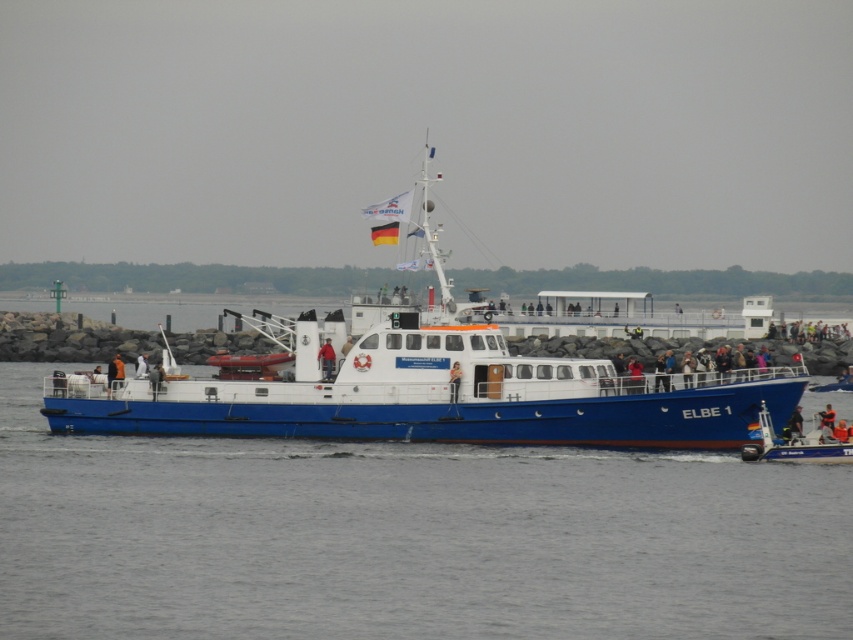
You are on the deck of the ferry ELBE 1 and need to locate a specific orange fabric jacket at center. According to the coordinates provided, where exactly would you find this jacket?

The orange fabric jacket at center is located at the coordinates point (115, 372).

You are on the deck of the ferry ELBE 1 and want to take a photo of both point (225, 468) and point (798, 456). Which point should you focus on first to ensure both are in clear view?

You should focus on point (225, 468) first because it is closer to the camera than point (798, 456), ensuring both points are in clear view.